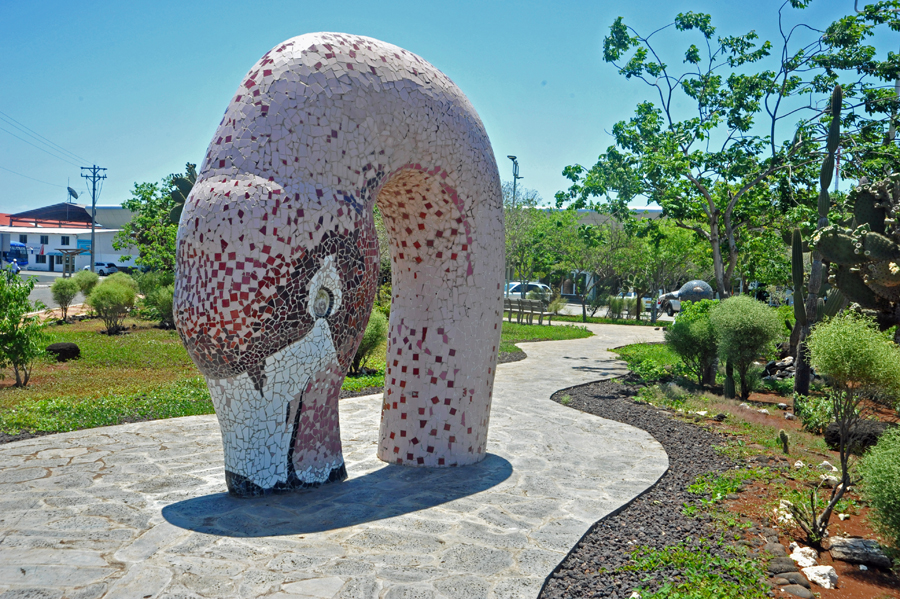
This screenshot has height=599, width=900. What are the coordinates of `white tiles` in the screenshot? It's located at pyautogui.click(x=280, y=107), pyautogui.click(x=299, y=93), pyautogui.click(x=328, y=107), pyautogui.click(x=379, y=105), pyautogui.click(x=398, y=120).